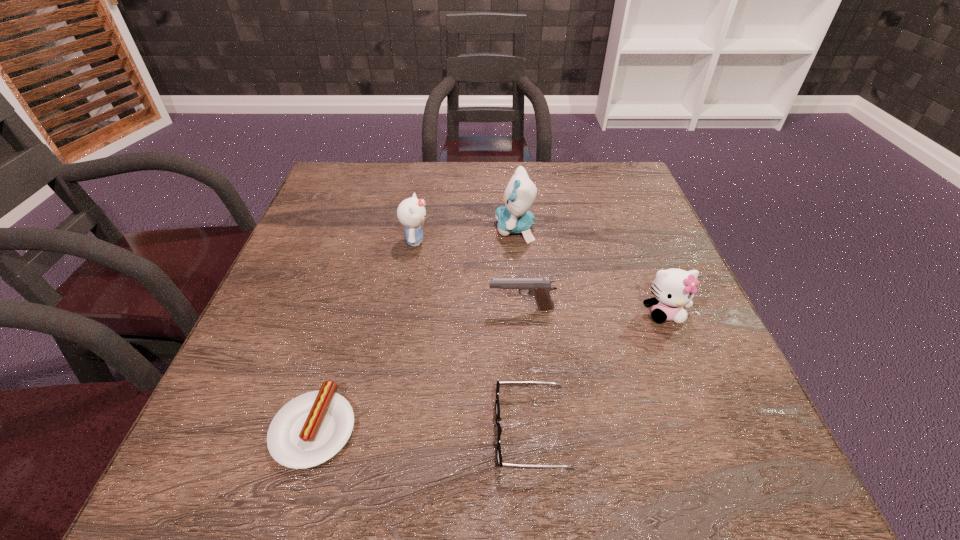
Identify the location of vacant region located on the face of the tallest object. (408, 229).

I want to click on vacant area situated 0.330m on the face of the tallest object, so click(358, 229).

This screenshot has height=540, width=960. Identify the location of vacant space located on the front-facing side of the leftmost kitten. (592, 241).

At what (x,y) coordinates should I click in order to perform the action: click on vacant space located 0.090m on the front-facing side of the nearest kitten. Please return your answer as a coordinate pair (x, y). The width and height of the screenshot is (960, 540). Looking at the image, I should click on (686, 366).

I want to click on vacant region located 0.190m at the barrel of the third shortest object, so [x=393, y=308].

This screenshot has width=960, height=540. Identify the location of vacant area situated at the barrel of the third shortest object. (297, 308).

Locate an element on the screen. The width and height of the screenshot is (960, 540). vacant space located 0.090m at the barrel of the third shortest object is located at coordinates (444, 308).

The height and width of the screenshot is (540, 960). I want to click on free space located 0.240m on the front-facing side of the second shortest object, so click(340, 431).

The width and height of the screenshot is (960, 540). What are the coordinates of `vacant space situated on the front-facing side of the second shortest object` in the screenshot? It's located at (418, 431).

Image resolution: width=960 pixels, height=540 pixels. Identify the location of free space located on the front-facing side of the second shortest object. (392, 431).